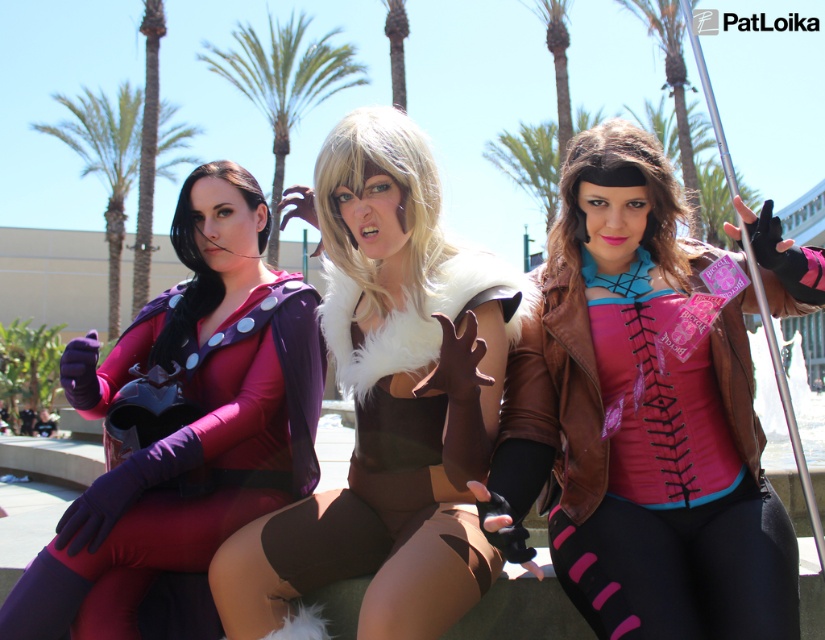
Does pink leather vest at center lie in front of matte purple bodysuit at left?

Yes, it is in front of matte purple bodysuit at left.

Does pink leather vest at center have a lesser width compared to matte purple bodysuit at left?

No.

Where is `pink leather vest at center`? This screenshot has width=825, height=640. pink leather vest at center is located at coordinates (639, 420).

Can you confirm if pink leather vest at center is positioned to the right of green leafy palm tree at left?

Yes, pink leather vest at center is to the right of green leafy palm tree at left.

Image resolution: width=825 pixels, height=640 pixels. Identify the location of pink leather vest at center. (639, 420).

Between brown fur vest at center and green leafy palm tree at upper center, which one has more height?

Standing taller between the two is green leafy palm tree at upper center.

Who is positioned more to the right, brown fur vest at center or green leafy palm tree at upper center?

From the viewer's perspective, brown fur vest at center appears more on the right side.

Measure the distance between point (324,141) and camera.

They are 5.68 meters apart.

I want to click on brown fur vest at center, so click(389, 401).